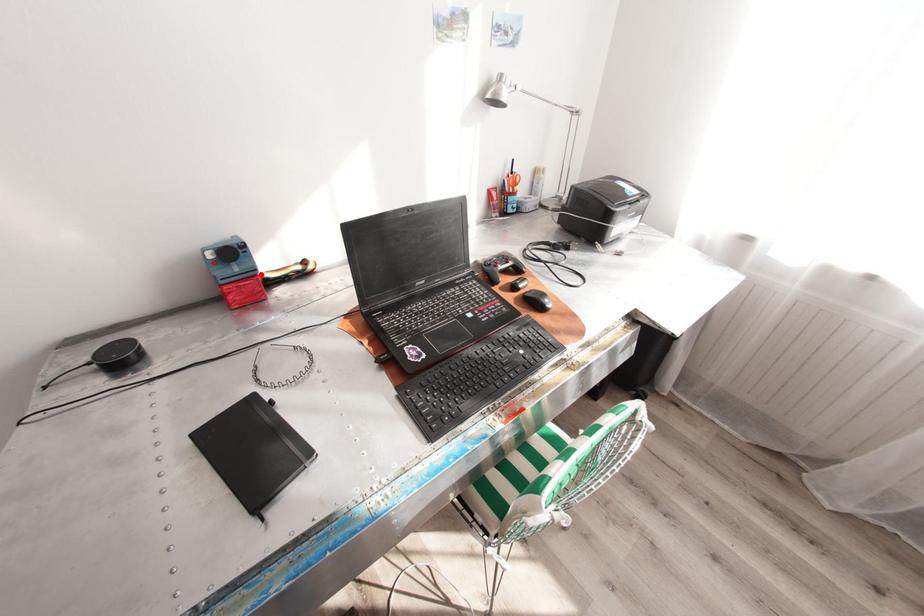
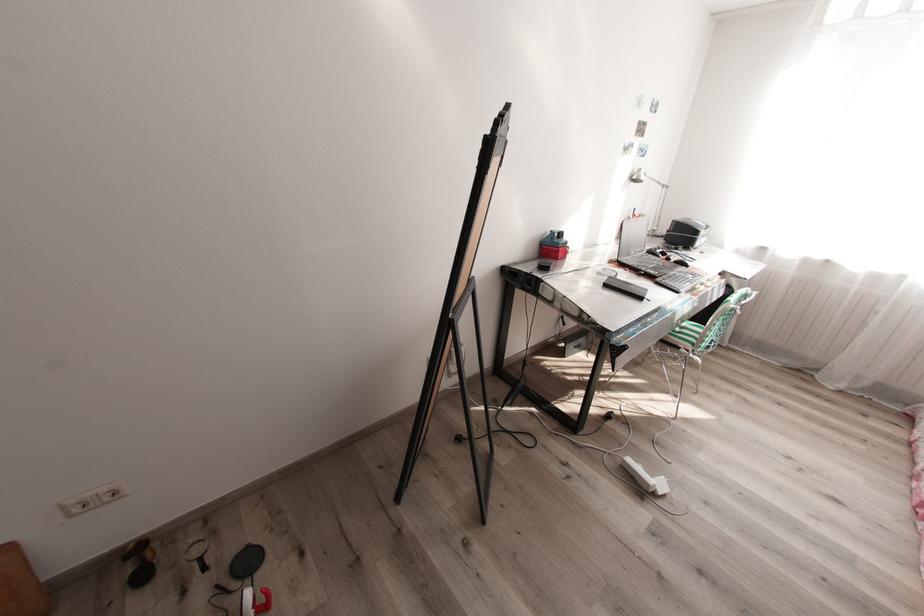
Question: I am providing you with two images of the same scene from different viewpoints. A red point is marked on the first image. At the location where the point appears in image 1, is it still visible in image 2?

Choices:
 (A) Yes
 (B) No

Answer: (B)